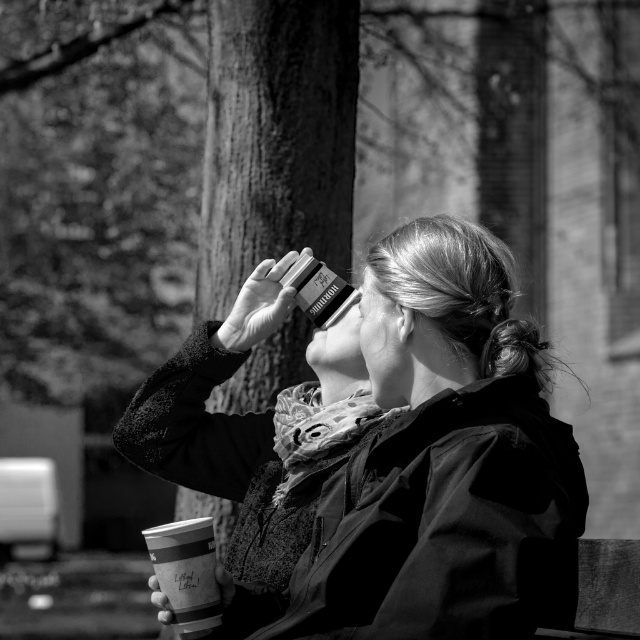
Question: Which point is closer to the camera?

Choices:
 (A) matte black jacket at center
 (B) paper cup at lower left

Answer: (A)

Question: Is matte black jacket at center smaller than paper cup at lower left?

Choices:
 (A) yes
 (B) no

Answer: (B)

Question: Does matte black jacket at center have a smaller size compared to smooth bark tree at center?

Choices:
 (A) no
 (B) yes

Answer: (A)

Question: Among these points, which one is farthest from the camera?

Choices:
 (A) (161, 552)
 (B) (321, 76)

Answer: (B)

Question: Estimate the real-world distances between objects in this image. Which object is closer to the smooth bark tree at center?

Choices:
 (A) matte black jacket at center
 (B) paper cup at lower left

Answer: (B)

Question: Observing the image, what is the correct spatial positioning of matte black jacket at center in reference to paper cup at lower left?

Choices:
 (A) below
 (B) above

Answer: (B)